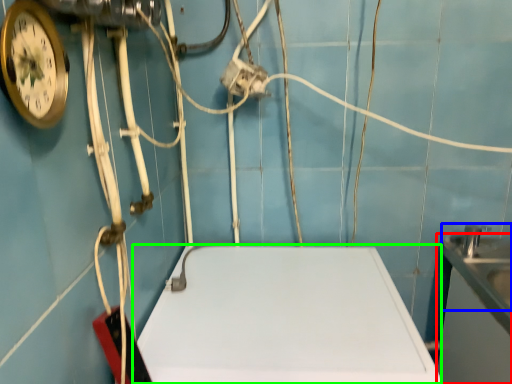
Question: Based on their relative distances, which object is farther from counter top (highlighted by a red box)? Choose from sink (highlighted by a blue box) and counter top (highlighted by a green box).

Choices:
 (A) sink
 (B) counter top

Answer: (B)